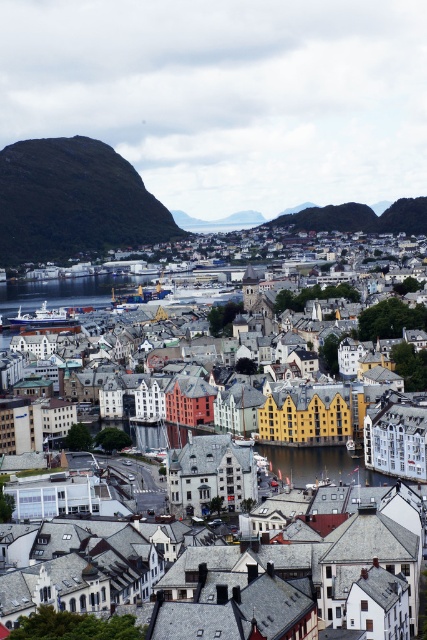
Can you confirm if yellow matte building at center is positioned below dark gray rocky mountain at left?

Yes.

I want to click on yellow matte building at center, so click(x=339, y=481).

From the picture: Does yellow matte building at center have a lesser height compared to transparent water at center?

In fact, yellow matte building at center may be taller than transparent water at center.

Is yellow matte building at center taller than transparent water at center?

Yes.

The height and width of the screenshot is (640, 427). I want to click on yellow matte building at center, so click(x=339, y=481).

Which is more to the left, dark gray rocky mountain at left or transparent water at center?

dark gray rocky mountain at left is more to the left.

Where is `dark gray rocky mountain at left`? dark gray rocky mountain at left is located at coordinates (73, 202).